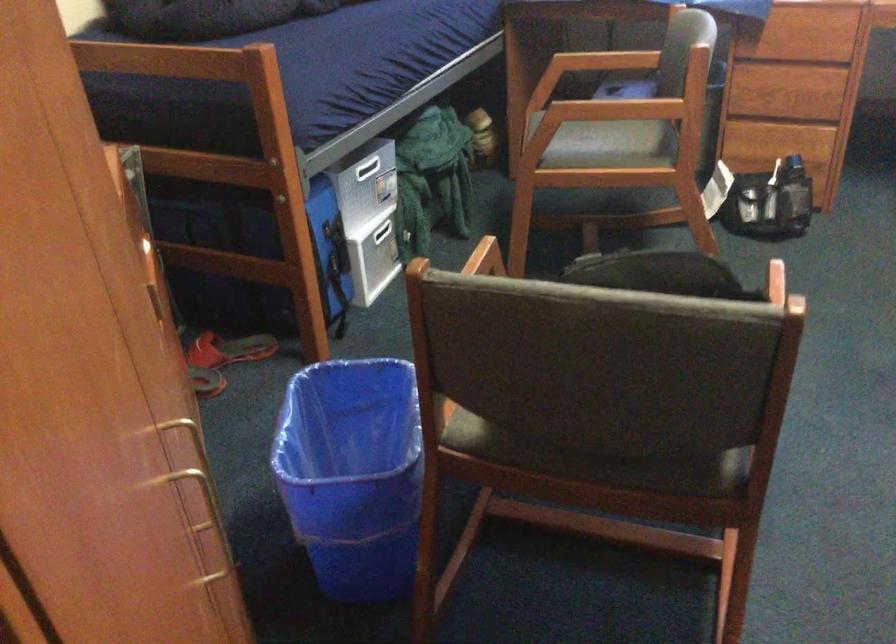
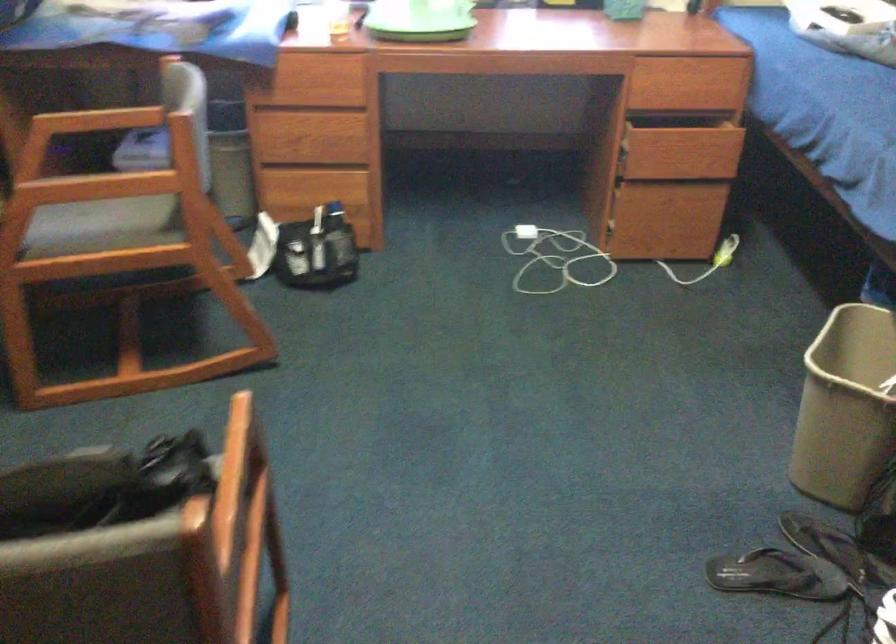
Question: The camera is either moving clockwise (left) or counter-clockwise (right) around the object. The first image is from the beginning of the video and the second image is from the end. Is the camera moving left or right when shooting the video?

Choices:
 (A) Left
 (B) Right

Answer: (A)